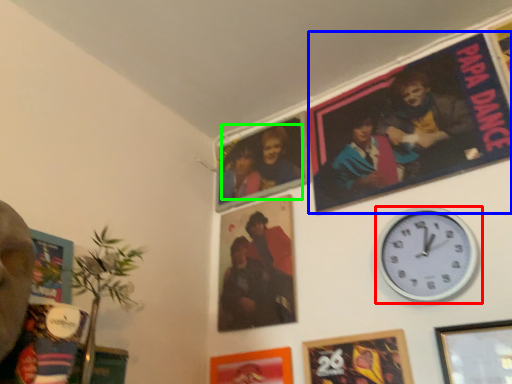
Question: Based on their relative distances, which object is nearer to wall clock (highlighted by a red box)? Choose from movie poster (highlighted by a blue box) and couple (highlighted by a green box).

Choices:
 (A) movie poster
 (B) couple

Answer: (A)